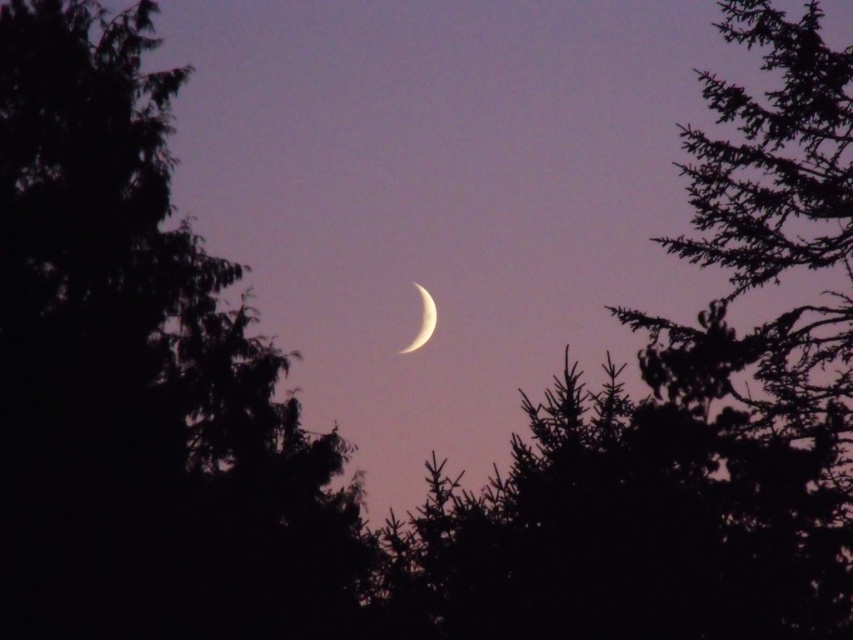
Question: Is green leafy tree at center further to the viewer compared to white glossy crescent moon at center?

Choices:
 (A) yes
 (B) no

Answer: (B)

Question: Estimate the real-world distances between objects in this image. Which object is closer to the white glossy crescent moon at center?

Choices:
 (A) dark green leafy tree at center
 (B) green leafy tree at center

Answer: (A)

Question: Is dark green leafy tree at center to the right of white glossy crescent moon at center from the viewer's perspective?

Choices:
 (A) no
 (B) yes

Answer: (A)

Question: Is green leafy tree at center bigger than white glossy crescent moon at center?

Choices:
 (A) yes
 (B) no

Answer: (A)

Question: Considering the real-world distances, which object is farthest from the dark green leafy tree at center?

Choices:
 (A) green leafy tree at center
 (B) white glossy crescent moon at center

Answer: (B)

Question: Estimate the real-world distances between objects in this image. Which object is closer to the dark green leafy tree at center?

Choices:
 (A) green leafy tree at center
 (B) white glossy crescent moon at center

Answer: (A)